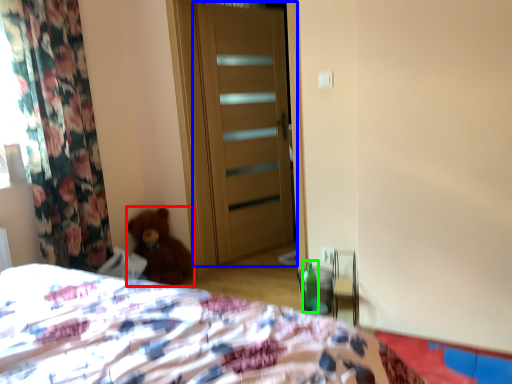
Question: Based on their relative distances, which object is farther from teddy bear (highlighted by a red box)? Choose from door (highlighted by a blue box) and bottle (highlighted by a green box).

Choices:
 (A) door
 (B) bottle

Answer: (B)